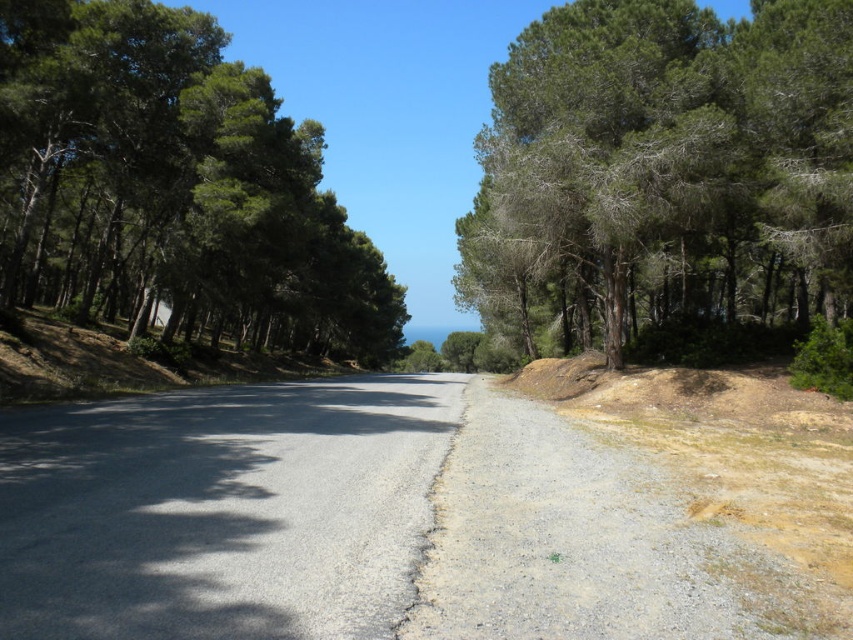
You are standing on the tree lined road and want to walk to the point marked at coordinate point (216, 490). How far will you have to walk to reach that point?

The point marked at coordinate point (216, 490) is 7.13 meters away from you, so you will have to walk 7.13 meters to reach it.